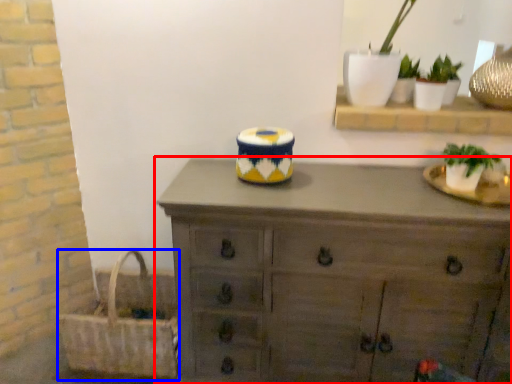
Question: Which object is closer to the camera taking this photo, chest of drawers (highlighted by a red box) or picnic basket (highlighted by a blue box)?

Choices:
 (A) chest of drawers
 (B) picnic basket

Answer: (A)